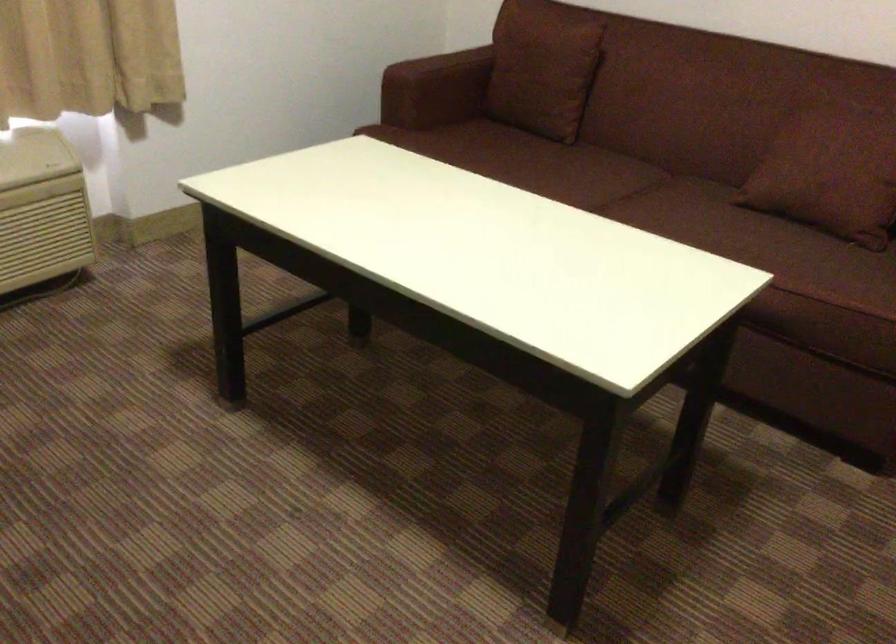
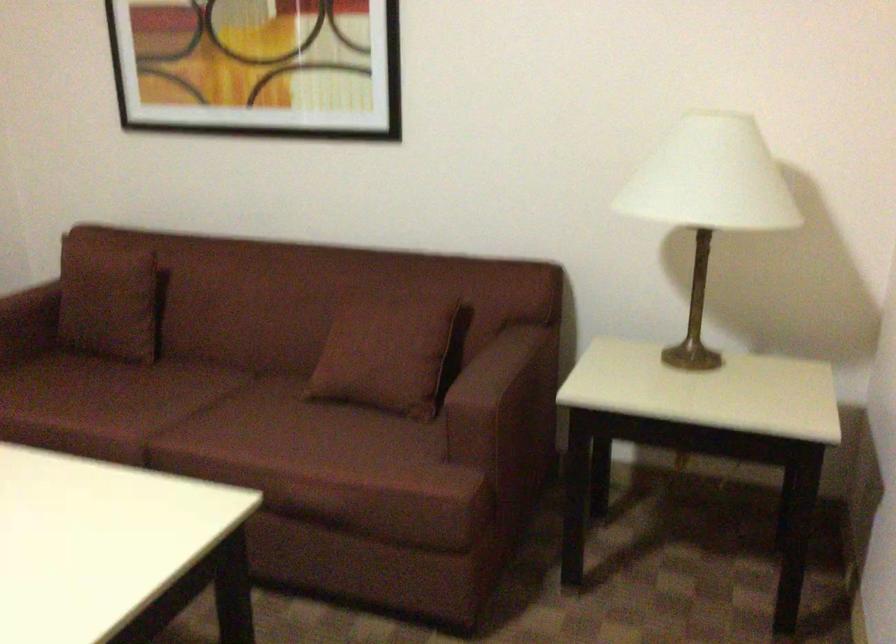
Question: Which direction would the cameraman need to move to produce the second image? Reply with the corresponding letter.

Choices:
 (A) Left
 (B) Right
 (C) Forward
 (D) Backward

Answer: (B)